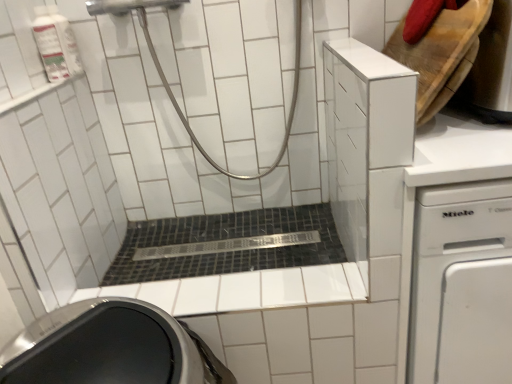
Locate an element on the screen. The height and width of the screenshot is (384, 512). metallic silver showerhead at upper left is located at coordinates (167, 81).

What do you see at coordinates (167, 81) in the screenshot? I see `metallic silver showerhead at upper left` at bounding box center [167, 81].

Identify the location of metallic silver showerhead at upper left. click(167, 81).